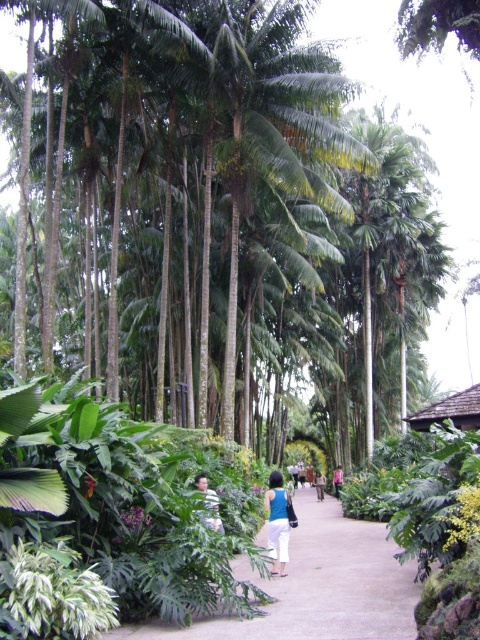
Which of these two, blue fabric shirt at center or light blue fabric shirt at center, stands shorter?

A: blue fabric shirt at center is shorter.

The height and width of the screenshot is (640, 480). What do you see at coordinates (277, 522) in the screenshot?
I see `blue fabric shirt at center` at bounding box center [277, 522].

This screenshot has height=640, width=480. Find the location of `blue fabric shirt at center`. blue fabric shirt at center is located at coordinates (277, 522).

Find the location of a particular element. The image size is (480, 640). smooth concrete path at center is located at coordinates (317, 586).

Who is positioned more to the right, smooth concrete path at center or blue fabric shirt at center?

smooth concrete path at center is more to the right.

Find the location of a particular element. The image size is (480, 640). smooth concrete path at center is located at coordinates (317, 586).

This screenshot has height=640, width=480. What are the coordinates of `smooth concrete path at center` in the screenshot? It's located at (317, 586).

Does smooth concrete path at center come in front of light brown leather jacket at center?

Yes, it is in front of light brown leather jacket at center.

Can you confirm if smooth concrete path at center is taller than light brown leather jacket at center?

Yes.

Where is `smooth concrete path at center`? smooth concrete path at center is located at coordinates (317, 586).